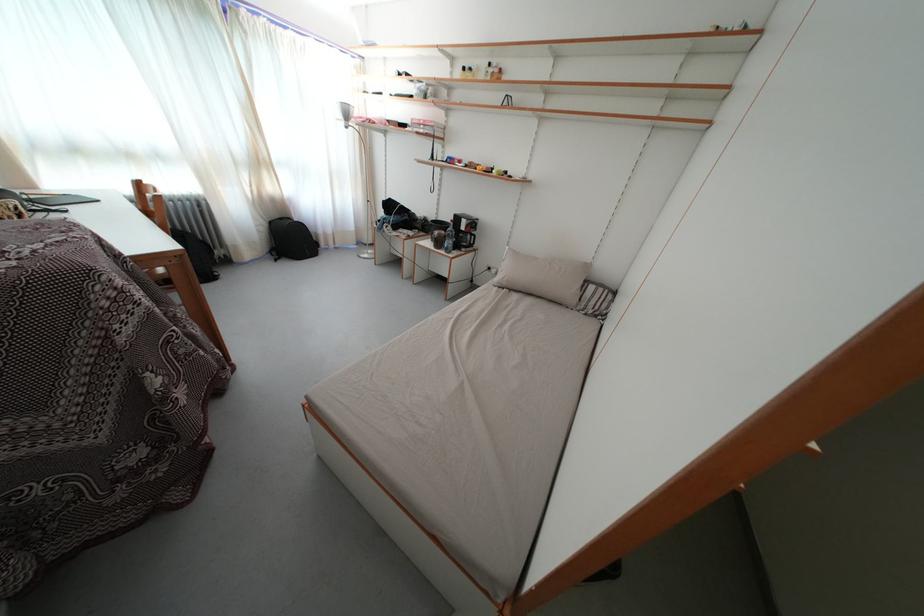
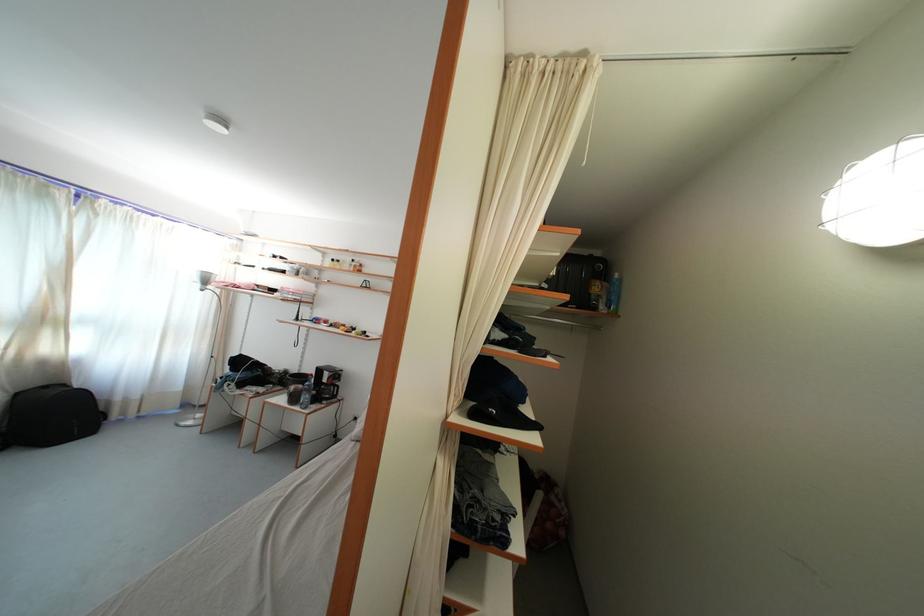
Where in the second image is the point corresponding to [335,238] from the first image?

(141, 403)